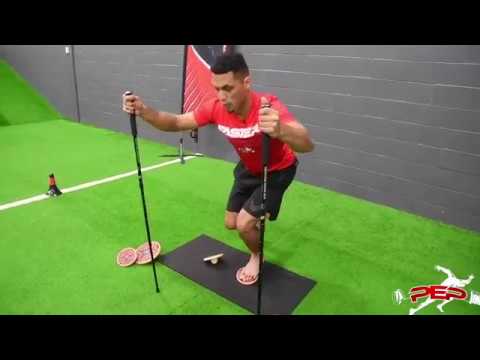
The width and height of the screenshot is (480, 360). In order to click on mat in this screenshot , I will do `click(221, 265)`.